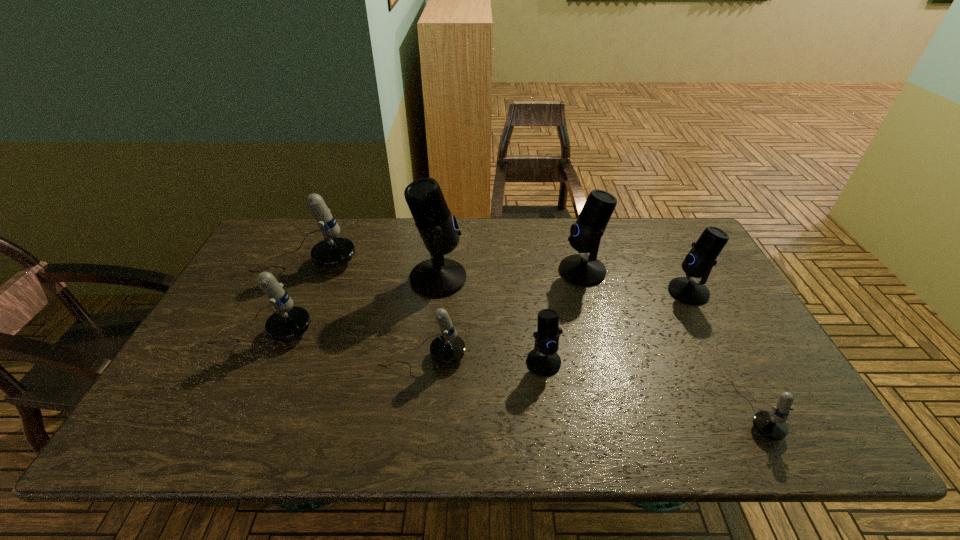
I want to click on free region located on the right of the third smallest white microphone, so click(457, 332).

The image size is (960, 540). I want to click on vacant space located on the back of the third white microphone from left to right, so click(x=430, y=300).

You are a GUI agent. You are given a task and a screenshot of the screen. Output one action in this format:
    pyautogui.click(x=<x>, y=<y>)
    Task: Click on the free point located on the stand of the smallest black microphone
    
    Given the screenshot: What is the action you would take?
    pyautogui.click(x=549, y=401)

This screenshot has height=540, width=960. Identify the location of blank space located on the left of the nearest white microphone. (696, 411).

What are the coordinates of `object located at the near edge` in the screenshot? It's located at [x=771, y=425].

I want to click on object that is at the far left corner, so click(x=334, y=251).

I want to click on object located in the near right corner section of the desktop, so click(771, 425).

Locate an element on the screen. The width and height of the screenshot is (960, 540). vacant space at the far edge is located at coordinates (614, 255).

In the image, there is a desktop. Identify the location of vacant space at the near edge. The height and width of the screenshot is (540, 960). (632, 414).

You are a GUI agent. You are given a task and a screenshot of the screen. Output one action in this format:
    pyautogui.click(x=<x>, y=<y>)
    Task: Click on the vacant space at the left edge of the desktop
    The image size is (960, 540).
    Given the screenshot: What is the action you would take?
    pyautogui.click(x=211, y=322)